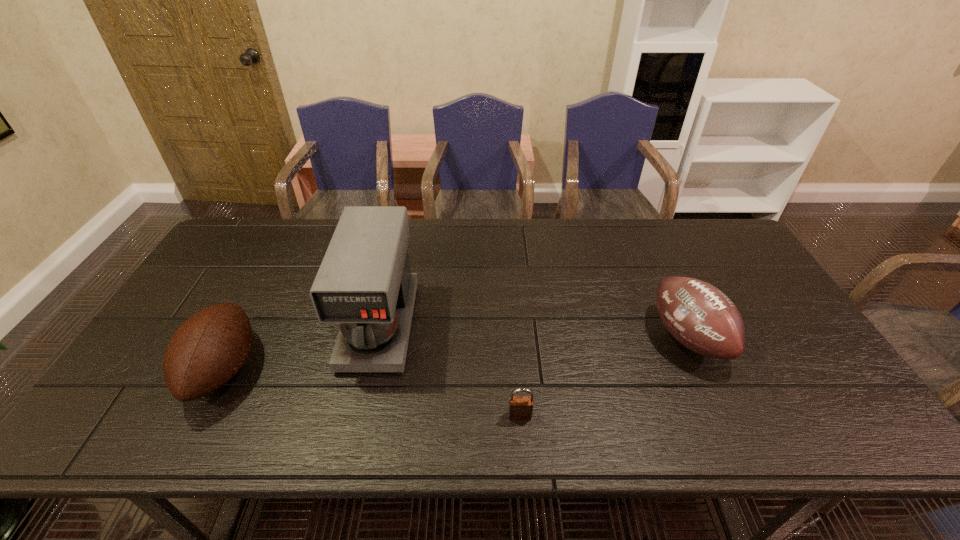
I want to click on vacant region between the shortest object and the coffee maker, so tap(450, 370).

Where is `free point between the tallest object and the rightmost object`? The width and height of the screenshot is (960, 540). free point between the tallest object and the rightmost object is located at coordinates (534, 331).

In order to click on empty space between the left football and the second object from left to right in this screenshot , I will do `click(301, 347)`.

Image resolution: width=960 pixels, height=540 pixels. What are the coordinates of `vacant point located between the right football and the second object from right to left` in the screenshot? It's located at (604, 377).

Locate an element on the screen. The height and width of the screenshot is (540, 960). vacant space that is in between the shortest object and the right football is located at coordinates (604, 377).

Image resolution: width=960 pixels, height=540 pixels. I want to click on empty space that is in between the shortest object and the rightmost object, so click(604, 377).

The image size is (960, 540). I want to click on free spot between the third object from right to left and the right football, so click(534, 331).

The height and width of the screenshot is (540, 960). I want to click on empty space that is in between the rightmost object and the second object from left to right, so click(x=534, y=331).

Find the location of a particular element. Image resolution: width=960 pixels, height=540 pixels. object that is the third closest to the rightmost object is located at coordinates (210, 347).

At what (x,y) coordinates should I click in order to perform the action: click on object that stands as the second closest to the shortest object. Please return your answer as a coordinate pair (x, y). Looking at the image, I should click on (698, 315).